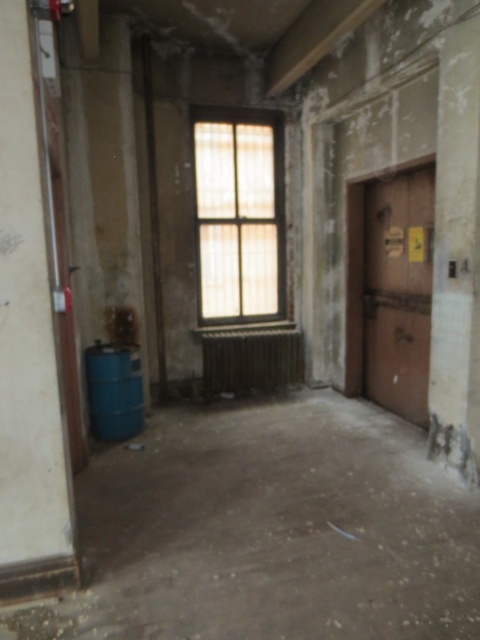
You are an interior designer assessing the room. You need to determine if a new decorative shelf that is 1.2 meters wide can fit between the translucent wood window at center and the metallic radiator at center. The shelf requires a space equal to its width. Can it fit?

The translucent wood window at center has a lesser width compared to metallic radiator at center. Since the window is narrower than the radiator, the space between them may vary depending on their placement. However, without specific distance information between the two objects, it is impossible to confirm if the 1.2 meter shelf will fit. Additional measurements are needed.

You are a delivery person trying to enter the room through the wooden door at right. However, there is a blue matte barrel at lower left blocking the doorway. Can you fit through the doorway if the space between the barrel and the door is 60 cm?

The wooden door at right is larger in size than the blue matte barrel at lower left, but the description does not provide specific measurements of the door or barrel. Therefore, it is impossible to determine if the 60 cm space is sufficient for the delivery person to pass through.